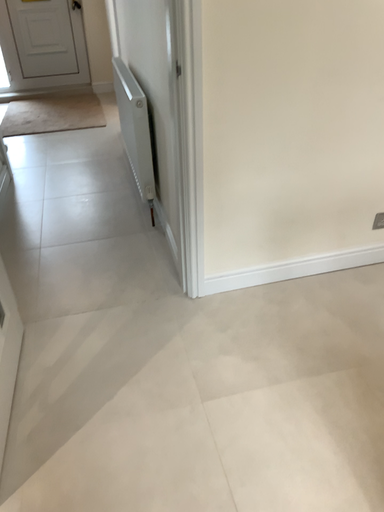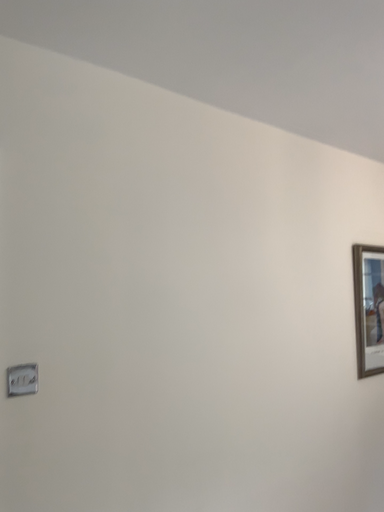
Question: Which way did the camera rotate in the video?

Choices:
 (A) rotated upward
 (B) rotated downward

Answer: (A)